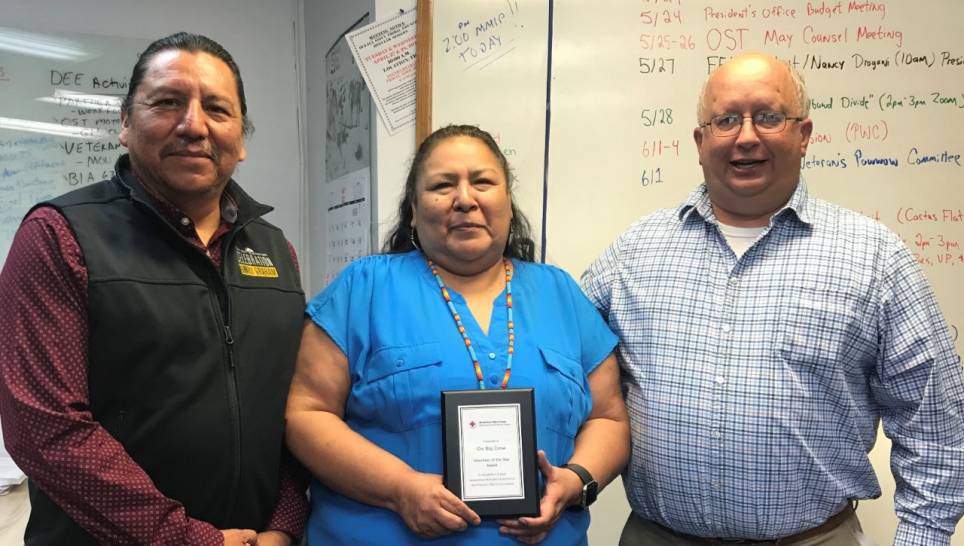
In order to click on calendar in this screenshot , I will do `click(349, 211)`.